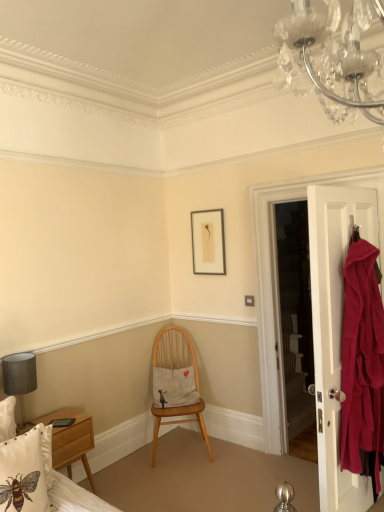
Question: From a real-world perspective, is matte gray lampshade at left on wooden chair at center?

Choices:
 (A) yes
 (B) no

Answer: (A)

Question: Can you confirm if matte gray lampshade at left is taller than wooden chair at center?

Choices:
 (A) no
 (B) yes

Answer: (A)

Question: From a real-world perspective, is matte gray lampshade at left positioned under wooden chair at center based on gravity?

Choices:
 (A) yes
 (B) no

Answer: (B)

Question: Does matte gray lampshade at left have a greater width compared to wooden chair at center?

Choices:
 (A) no
 (B) yes

Answer: (A)

Question: From the image's perspective, would you say matte gray lampshade at left is shown under wooden chair at center?

Choices:
 (A) no
 (B) yes

Answer: (A)

Question: Do you think matte gray lampshade at left is within white cotton cushion at center, arranged as the 2th pillow when viewed from the left, or outside of it?

Choices:
 (A) outside
 (B) inside

Answer: (A)

Question: In the image, is matte gray lampshade at left positioned in front of or behind white cotton cushion at center, which is the first pillow from back to front?

Choices:
 (A) front
 (B) behind

Answer: (A)

Question: Is point (31, 390) closer or farther from the camera than point (182, 395)?

Choices:
 (A) closer
 (B) farther

Answer: (A)

Question: Would you say matte gray lampshade at left is to the left or to the right of white cotton cushion at center, the 2th pillow in the front-to-back sequence, in the picture?

Choices:
 (A) left
 (B) right

Answer: (A)

Question: In terms of width, does matte white door at right look wider or thinner when compared to white cotton cushion at center, the first pillow viewed from the right?

Choices:
 (A) wide
 (B) thin

Answer: (B)

Question: Would you say matte white door at right is to the left or to the right of white cotton cushion at center, arranged as the 2th pillow when viewed from the left, in the picture?

Choices:
 (A) right
 (B) left

Answer: (A)

Question: Is matte white door at right in front of or behind white cotton cushion at center, arranged as the 2th pillow when viewed from the left, in the image?

Choices:
 (A) behind
 (B) front

Answer: (B)

Question: From a real-world perspective, is matte white door at right positioned above or below white cotton cushion at center, the 2th pillow in the front-to-back sequence?

Choices:
 (A) above
 (B) below

Answer: (A)

Question: In terms of width, does white cotton pillow with bee design at lower left, which is counted as the first pillow, starting from the left, look wider or thinner when compared to matte black picture frame at upper center?

Choices:
 (A) thin
 (B) wide

Answer: (B)

Question: From the image's perspective, is white cotton pillow with bee design at lower left, which is counted as the first pillow, starting from the left, positioned above or below matte black picture frame at upper center?

Choices:
 (A) above
 (B) below

Answer: (B)